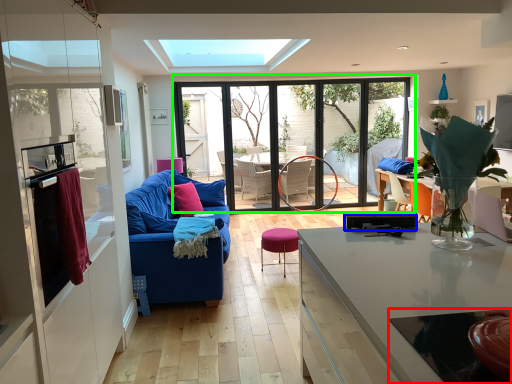
Question: Estimate the real-world distances between objects in this image. Which object is closer to glass table (highlighted by a red box), appliance (highlighted by a blue box) or window (highlighted by a green box)?

Choices:
 (A) appliance
 (B) window

Answer: (A)